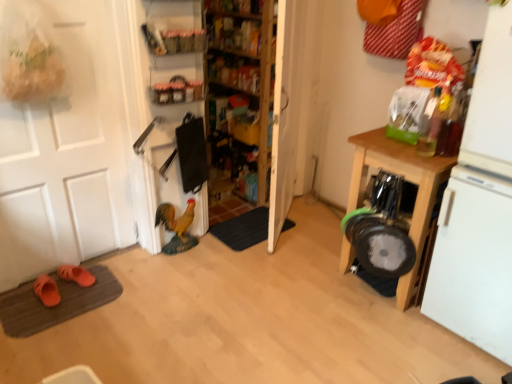
Where is `vacant area that lies between orange rubber slippers at lower left, acting as the 2th footwear starting from the back, and orange suede slippers at lower left, which is the 2th footwear from front to back`? The width and height of the screenshot is (512, 384). vacant area that lies between orange rubber slippers at lower left, acting as the 2th footwear starting from the back, and orange suede slippers at lower left, which is the 2th footwear from front to back is located at coordinates (x=67, y=294).